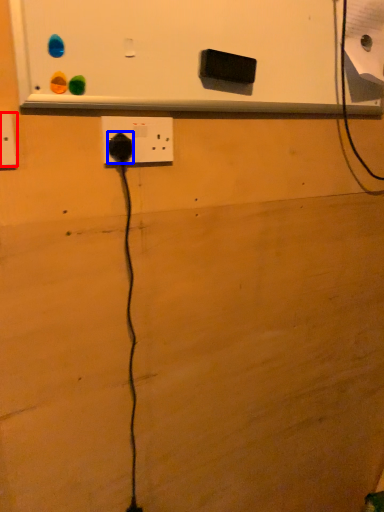
Question: Which object appears farthest to the camera in this image, power plugs and sockets (highlighted by a red box) or power plugs and sockets (highlighted by a blue box)?

Choices:
 (A) power plugs and sockets
 (B) power plugs and sockets

Answer: (B)